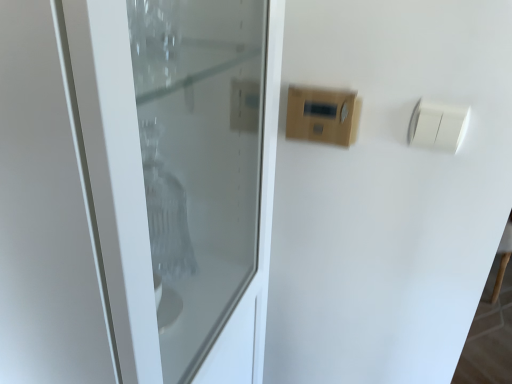
The image size is (512, 384). Find the location of `wooden panel at upper center, placed as the first light switch when sorted from left to right`. wooden panel at upper center, placed as the first light switch when sorted from left to right is located at coordinates (322, 115).

Image resolution: width=512 pixels, height=384 pixels. What do you see at coordinates (179, 178) in the screenshot?
I see `white glossy door at center` at bounding box center [179, 178].

This screenshot has height=384, width=512. I want to click on white plastic light switch at upper right, the first light switch positioned from the right, so click(438, 125).

Locate an element on the screen. This screenshot has width=512, height=384. wooden panel at upper center, which is the second light switch in right-to-left order is located at coordinates (322, 115).

How distant is wooden panel at upper center, placed as the first light switch when sorted from left to right, from white plastic light switch at upper right, acting as the 2th light switch starting from the left?

wooden panel at upper center, placed as the first light switch when sorted from left to right, and white plastic light switch at upper right, acting as the 2th light switch starting from the left, are 5.60 inches apart.

Between wooden panel at upper center, placed as the first light switch when sorted from left to right, and white plastic light switch at upper right, acting as the 2th light switch starting from the left, which one appears on the left side from the viewer's perspective?

Positioned to the left is wooden panel at upper center, placed as the first light switch when sorted from left to right.

From the image's perspective, relative to white plastic light switch at upper right, acting as the 2th light switch starting from the left, is wooden panel at upper center, which is the second light switch in right-to-left order, above or below?

Based on their image positions, wooden panel at upper center, which is the second light switch in right-to-left order, is located above white plastic light switch at upper right, acting as the 2th light switch starting from the left.

Which point is more distant from viewer, [351,100] or [426,131]?

Positioned behind is point [351,100].

Is white glossy door at center facing towards wooden panel at upper center, placed as the first light switch when sorted from left to right?

No, white glossy door at center does not turn towards wooden panel at upper center, placed as the first light switch when sorted from left to right.

Locate an element on the screen. This screenshot has width=512, height=384. the 1st light switch to the right of the white glossy door at center, starting your count from the anchor is located at coordinates (322, 115).

Does white glossy door at center come in front of wooden panel at upper center, which is the second light switch in right-to-left order?

Yes, white glossy door at center is in front of wooden panel at upper center, which is the second light switch in right-to-left order.

Considering the positions of point (182, 168) and point (343, 116), is point (182, 168) closer or farther from the camera than point (343, 116)?

Point (182, 168) is farther from the camera than point (343, 116).

Considering the positions of objects wooden panel at upper center, which is the second light switch in right-to-left order, and white glossy door at center in the image provided, who is more to the right, wooden panel at upper center, which is the second light switch in right-to-left order, or white glossy door at center?

wooden panel at upper center, which is the second light switch in right-to-left order, is more to the right.

Locate an element on the screen. The width and height of the screenshot is (512, 384). the 1st light switch counting from the right side of the white glossy door at center is located at coordinates (322, 115).

From the image's perspective, which one is positioned higher, wooden panel at upper center, placed as the first light switch when sorted from left to right, or white glossy door at center?

wooden panel at upper center, placed as the first light switch when sorted from left to right.

Considering the relative sizes of white glossy door at center and white plastic light switch at upper right, acting as the 2th light switch starting from the left, in the image provided, is white glossy door at center taller than white plastic light switch at upper right, acting as the 2th light switch starting from the left,?

Indeed, white glossy door at center has a greater height compared to white plastic light switch at upper right, acting as the 2th light switch starting from the left.

Is white glossy door at center directly adjacent to white plastic light switch at upper right, the first light switch positioned from the right?

No, white glossy door at center is not making contact with white plastic light switch at upper right, the first light switch positioned from the right.

From a real-world perspective, which object rests below the other?

white glossy door at center is physically lower.

In terms of width, does white glossy door at center look wider or thinner when compared to white plastic light switch at upper right, acting as the 2th light switch starting from the left?

white glossy door at center is wider than white plastic light switch at upper right, acting as the 2th light switch starting from the left.

Is point (414, 134) positioned behind point (312, 119)?

No, it is in front of (312, 119).

Which is in front, white plastic light switch at upper right, acting as the 2th light switch starting from the left, or wooden panel at upper center, placed as the first light switch when sorted from left to right?

white plastic light switch at upper right, acting as the 2th light switch starting from the left, is closer to the camera.

Is white plastic light switch at upper right, acting as the 2th light switch starting from the left, situated inside wooden panel at upper center, which is the second light switch in right-to-left order, or outside?

The correct answer is: outside.

Does white plastic light switch at upper right, acting as the 2th light switch starting from the left, lie behind white glossy door at center?

Yes, white plastic light switch at upper right, acting as the 2th light switch starting from the left, is behind white glossy door at center.

From a real-world perspective, is white plastic light switch at upper right, acting as the 2th light switch starting from the left, on white glossy door at center?

Yes, from a real-world perspective, white plastic light switch at upper right, acting as the 2th light switch starting from the left, is on top of white glossy door at center.

Based on the photo, would you say white glossy door at center is part of white plastic light switch at upper right, the first light switch positioned from the right,'s contents?

No, white glossy door at center is not inside white plastic light switch at upper right, the first light switch positioned from the right.

You are a GUI agent. You are given a task and a screenshot of the screen. Output one action in this format:
    pyautogui.click(x=<x>, y=<y>)
    Task: Click on the light switch above the wooden panel at upper center, which is the second light switch in right-to-left order (from a real-world perspective)
    This screenshot has height=384, width=512.
    Given the screenshot: What is the action you would take?
    pyautogui.click(x=438, y=125)

The height and width of the screenshot is (384, 512). Find the location of `door that is in front of the wooden panel at upper center, placed as the first light switch when sorted from left to right`. door that is in front of the wooden panel at upper center, placed as the first light switch when sorted from left to right is located at coordinates (179, 178).

From the image, which object appears to be farther from white plastic light switch at upper right, acting as the 2th light switch starting from the left, wooden panel at upper center, which is the second light switch in right-to-left order, or white glossy door at center?

white glossy door at center is further to white plastic light switch at upper right, acting as the 2th light switch starting from the left.

Estimate the real-world distances between objects in this image. Which object is further from white plastic light switch at upper right, acting as the 2th light switch starting from the left, white glossy door at center or wooden panel at upper center, which is the second light switch in right-to-left order?

white glossy door at center is positioned further to the anchor white plastic light switch at upper right, acting as the 2th light switch starting from the left.

Considering their positions, is white plastic light switch at upper right, the first light switch positioned from the right, positioned closer to wooden panel at upper center, placed as the first light switch when sorted from left to right, than white glossy door at center?

white plastic light switch at upper right, the first light switch positioned from the right, is closer to wooden panel at upper center, placed as the first light switch when sorted from left to right.

Considering their positions, is white glossy door at center positioned closer to wooden panel at upper center, placed as the first light switch when sorted from left to right, than white plastic light switch at upper right, acting as the 2th light switch starting from the left?

white plastic light switch at upper right, acting as the 2th light switch starting from the left, lies closer to wooden panel at upper center, placed as the first light switch when sorted from left to right, than the other object.

Which object lies nearer to the anchor point white glossy door at center, white plastic light switch at upper right, the first light switch positioned from the right, or wooden panel at upper center, placed as the first light switch when sorted from left to right?

The object closer to white glossy door at center is wooden panel at upper center, placed as the first light switch when sorted from left to right.

Which object lies nearer to the anchor point white glossy door at center, wooden panel at upper center, which is the second light switch in right-to-left order, or white plastic light switch at upper right, acting as the 2th light switch starting from the left?

Based on the image, wooden panel at upper center, which is the second light switch in right-to-left order, appears to be nearer to white glossy door at center.

Locate an element on the screen. light switch between white glossy door at center and wooden panel at upper center, which is the second light switch in right-to-left order, from front to back is located at coordinates (438, 125).